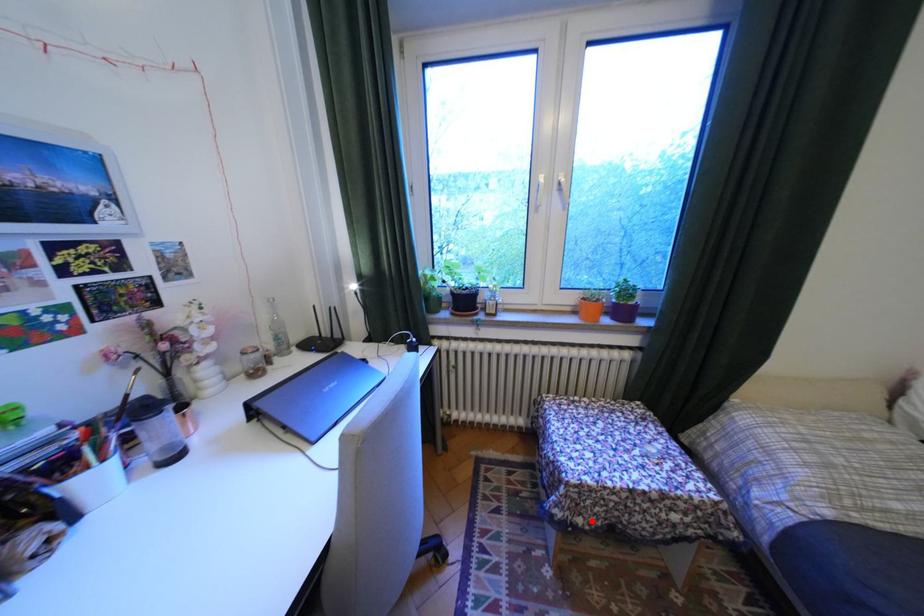
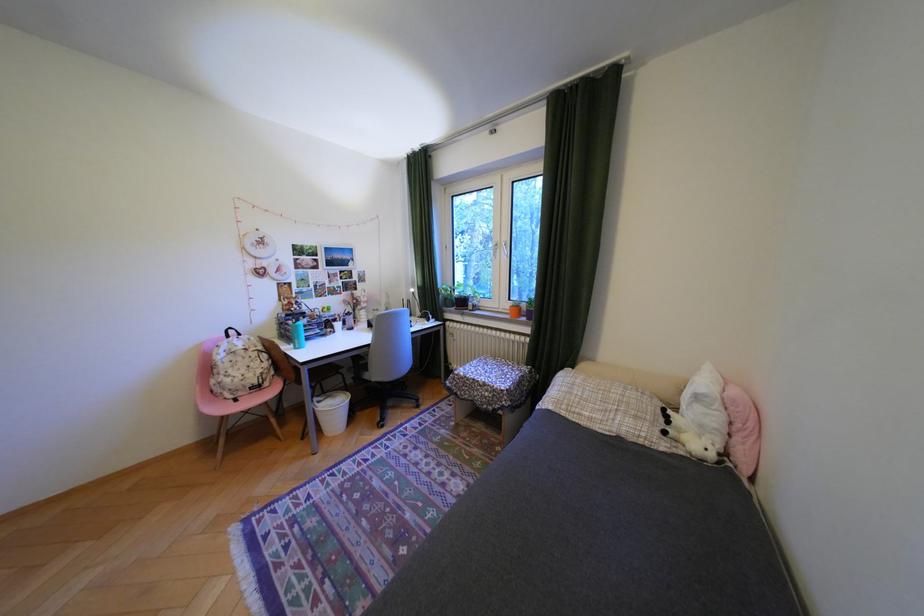
The point at the highlighted location is marked in the first image. Where is the corresponding point in the second image?

(470, 392)